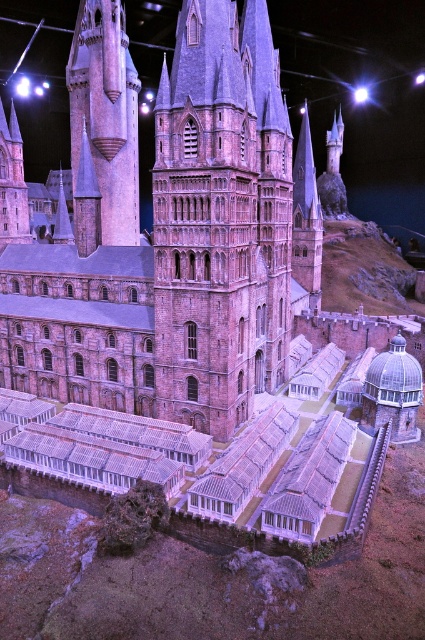
Question: Is smooth stone tower at upper left positioned behind brick tower at left?

Choices:
 (A) yes
 (B) no

Answer: (A)

Question: Can you confirm if brick stone tower at center is bigger than brick tower at left?

Choices:
 (A) no
 (B) yes

Answer: (A)

Question: Estimate the real-world distances between objects in this image. Which object is closer to the brick tower at left?

Choices:
 (A) smooth stone tower at upper left
 (B) brick stone tower at center

Answer: (A)

Question: Which point is farther from the camera taking this photo?

Choices:
 (A) (113, 164)
 (B) (17, 227)

Answer: (A)

Question: From the image, what is the correct spatial relationship of smooth stone tower at upper left in relation to brick tower at left?

Choices:
 (A) below
 (B) above

Answer: (A)

Question: Which of the following is the closest to the observer?

Choices:
 (A) (130, 152)
 (B) (3, 163)

Answer: (B)